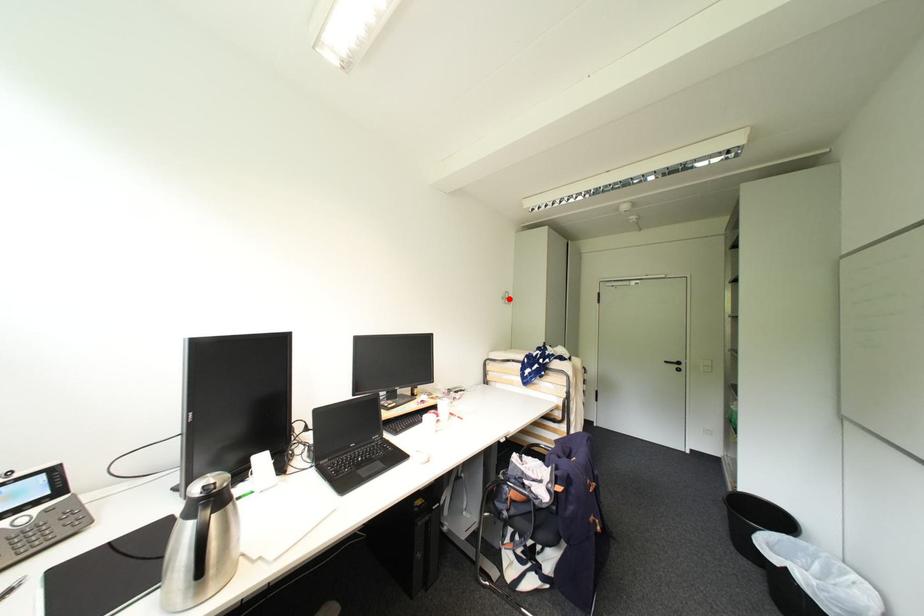
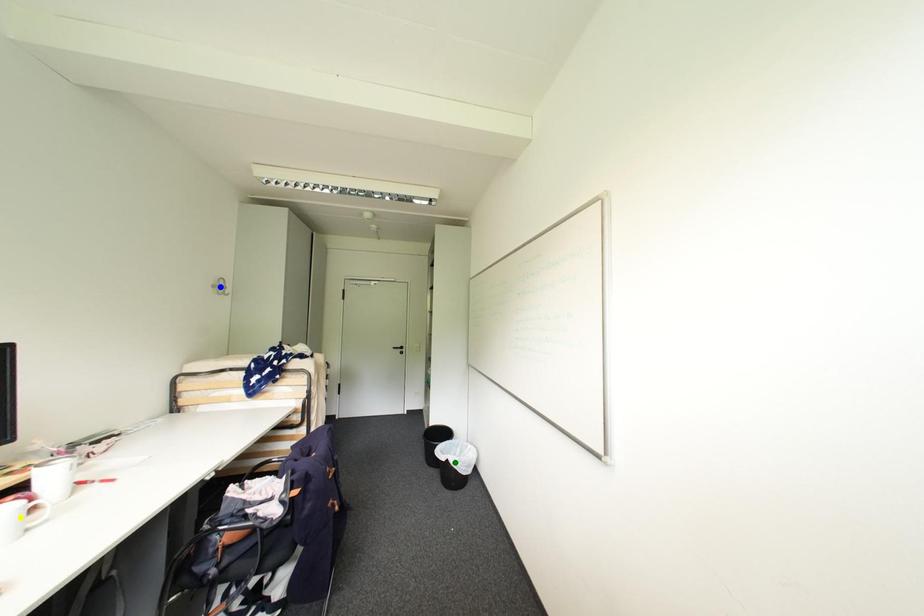
Question: I am providing you with two images of the same scene from different viewpoints. A red point is marked on the first image. You are given multiple points on the second image. Which spot in image 2 lines up with the point in image 1?

Choices:
 (A) blue point
 (B) green point
 (C) yellow point

Answer: (A)